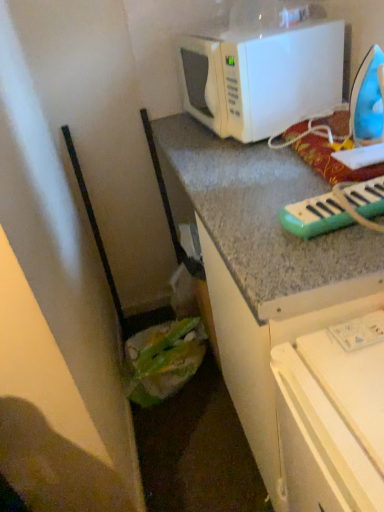
Question: Can you confirm if green plastic musical keyboard at upper right is thinner than white matte microwave at upper center?

Choices:
 (A) yes
 (B) no

Answer: (B)

Question: Would you consider green plastic musical keyboard at upper right to be distant from white matte microwave at upper center?

Choices:
 (A) yes
 (B) no

Answer: (B)

Question: Does green plastic musical keyboard at upper right appear on the right side of white matte microwave at upper center?

Choices:
 (A) no
 (B) yes

Answer: (B)

Question: Does green plastic musical keyboard at upper right have a greater width compared to white matte microwave at upper center?

Choices:
 (A) yes
 (B) no

Answer: (A)

Question: Is green plastic musical keyboard at upper right facing away from white matte microwave at upper center?

Choices:
 (A) yes
 (B) no

Answer: (B)

Question: In terms of size, does blue plastic iron at upper right appear bigger or smaller than green plastic musical keyboard at upper right?

Choices:
 (A) small
 (B) big

Answer: (B)

Question: From a real-world perspective, is blue plastic iron at upper right above or below green plastic musical keyboard at upper right?

Choices:
 (A) above
 (B) below

Answer: (A)

Question: Does point (359, 74) appear closer or farther from the camera than point (291, 215)?

Choices:
 (A) closer
 (B) farther

Answer: (B)

Question: Is blue plastic iron at upper right wider or thinner than green plastic musical keyboard at upper right?

Choices:
 (A) wide
 (B) thin

Answer: (B)

Question: Considering the positions of white matte microwave at upper center and green plastic musical keyboard at upper right in the image, is white matte microwave at upper center wider or thinner than green plastic musical keyboard at upper right?

Choices:
 (A) thin
 (B) wide

Answer: (A)

Question: From a real-world perspective, relative to green plastic musical keyboard at upper right, is white matte microwave at upper center vertically above or below?

Choices:
 (A) below
 (B) above

Answer: (B)

Question: From the image's perspective, relative to green plastic musical keyboard at upper right, is white matte microwave at upper center above or below?

Choices:
 (A) above
 (B) below

Answer: (A)

Question: Does point (233, 42) appear closer or farther from the camera than point (336, 222)?

Choices:
 (A) farther
 (B) closer

Answer: (A)

Question: Is green plastic musical keyboard at upper right taller or shorter than white matte microwave at upper center?

Choices:
 (A) tall
 (B) short

Answer: (B)

Question: From a real-world perspective, is green plastic musical keyboard at upper right physically located above or below white matte microwave at upper center?

Choices:
 (A) below
 (B) above

Answer: (A)